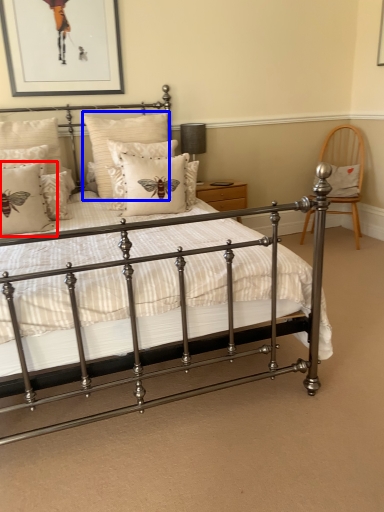
Question: Which object appears closest to the camera in this image, pillow (highlighted by a red box) or pillow (highlighted by a blue box)?

Choices:
 (A) pillow
 (B) pillow

Answer: (A)